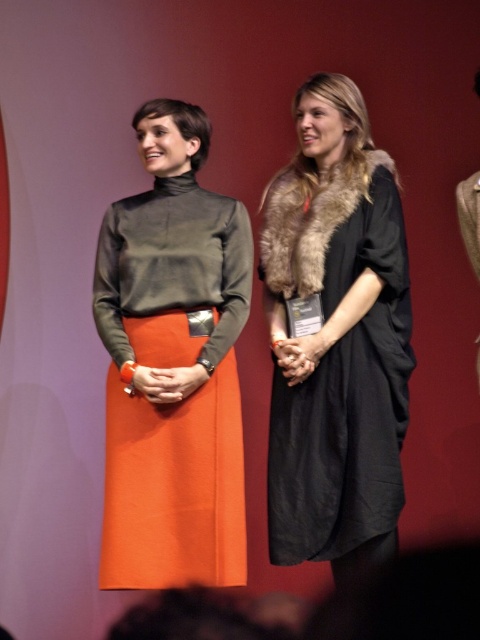
Question: Is the position of orange matte skirt at center less distant than that of black matte dress at right?

Choices:
 (A) yes
 (B) no

Answer: (B)

Question: Can you confirm if orange matte skirt at center is positioned above black matte dress at right?

Choices:
 (A) no
 (B) yes

Answer: (B)

Question: Where is orange matte skirt at center located in relation to black matte dress at right in the image?

Choices:
 (A) right
 (B) left

Answer: (B)

Question: Which object appears farthest from the camera in this image?

Choices:
 (A) black matte dress at right
 (B) orange matte skirt at center

Answer: (B)

Question: Which point is closer to the camera?

Choices:
 (A) (320, 275)
 (B) (206, 273)

Answer: (A)